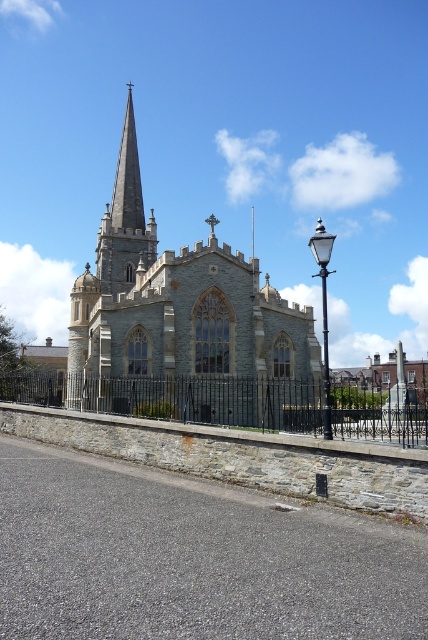
Which is above, black wrought iron fence at center or smooth gray steeple at center?

smooth gray steeple at center is above.

Who is lower down, black wrought iron fence at center or smooth gray steeple at center?

black wrought iron fence at center is below.

Is point (125, 381) positioned before point (133, 256)?

Yes, point (125, 381) is closer to viewer.

Locate an element on the screen. This screenshot has width=428, height=640. black wrought iron fence at center is located at coordinates (177, 397).

Is gray stone church at center positioned in front of smooth gray steeple at center?

That is True.

The image size is (428, 640). What are the coordinates of `gray stone church at center` in the screenshot? It's located at (178, 301).

From the picture: Can you confirm if gray stone church at center is smaller than black wrought iron fence at center?

Incorrect, gray stone church at center is not smaller in size than black wrought iron fence at center.

Is gray stone church at center wider than black wrought iron fence at center?

No.

Which is behind, point (86, 292) or point (157, 387)?

The point (86, 292) is behind.

Locate an element on the screen. gray stone church at center is located at coordinates (178, 301).